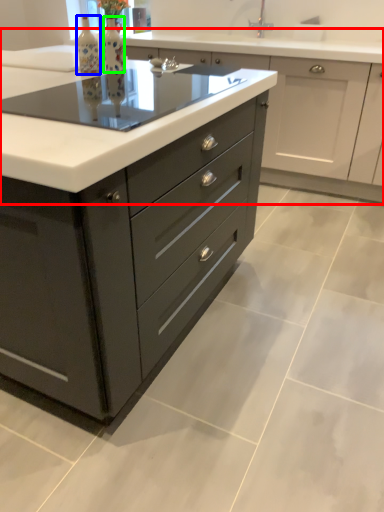
Question: Estimate the real-world distances between objects in this image. Which object is farther from cabinetry (highlighted by a red box), bottle (highlighted by a blue box) or bottle (highlighted by a green box)?

Choices:
 (A) bottle
 (B) bottle

Answer: (A)